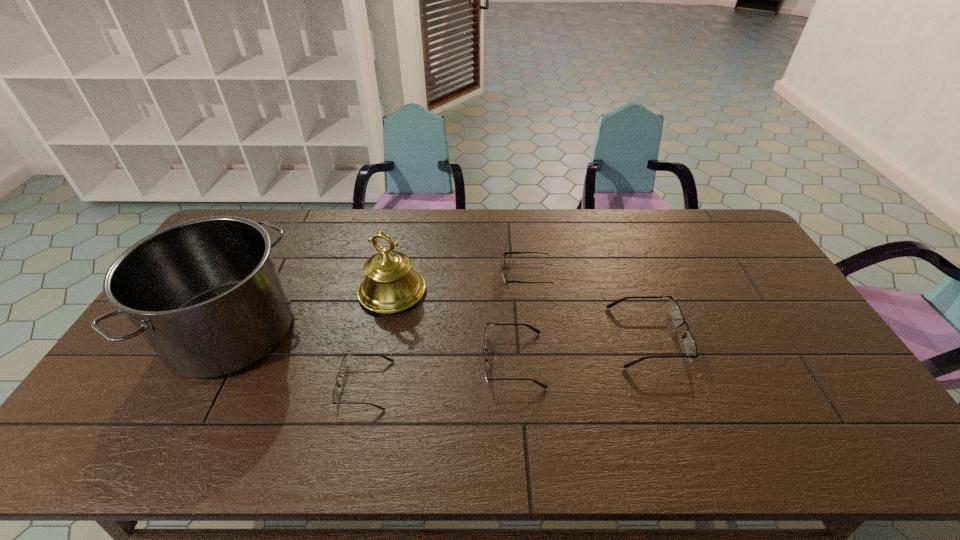
Identify the location of free spot located 0.110m on the front-facing side of the second spectacles from right to left. (443, 360).

Locate an element on the screen. This screenshot has width=960, height=540. vacant space situated 0.310m on the front-facing side of the second spectacles from right to left is located at coordinates (370, 360).

Locate an element on the screen. This screenshot has height=540, width=960. vacant region located on the front-facing side of the second spectacles from right to left is located at coordinates (388, 360).

You are a GUI agent. You are given a task and a screenshot of the screen. Output one action in this format:
    pyautogui.click(x=<x>, y=<y>)
    Task: Click on the vacant area situated on the front-facing side of the rightmost spectacles
    
    Given the screenshot: What is the action you would take?
    pyautogui.click(x=728, y=336)

You are a GUI agent. You are given a task and a screenshot of the screen. Output one action in this format:
    pyautogui.click(x=<x>, y=<y>)
    Task: Click on the vacant area situated on the right of the saucepan
    The image size is (960, 540).
    Given the screenshot: What is the action you would take?
    pyautogui.click(x=354, y=330)

Locate an element on the screen. free space located 0.230m on the left of the bell is located at coordinates (286, 291).

The width and height of the screenshot is (960, 540). Identify the location of vacant space located on the front-facing side of the sunglasses. (467, 274).

Find the location of a particular element. This screenshot has height=540, width=960. free location located 0.370m on the front-facing side of the sunglasses is located at coordinates (388, 274).

Where is `free space located on the front-facing side of the sunglasses`? This screenshot has width=960, height=540. free space located on the front-facing side of the sunglasses is located at coordinates (478, 274).

Image resolution: width=960 pixels, height=540 pixels. Identify the location of saucepan present at the near edge. (205, 293).